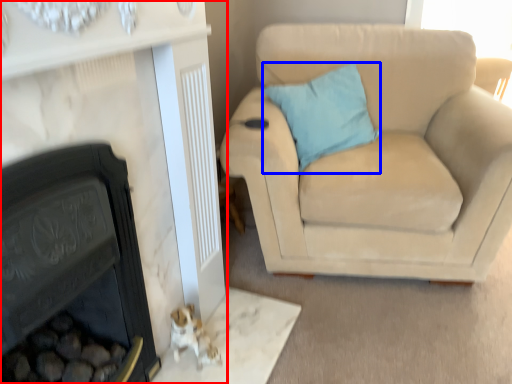
Question: Which of the following is the farthest to the observer, fireplace (highlighted by a red box) or pillow (highlighted by a blue box)?

Choices:
 (A) fireplace
 (B) pillow

Answer: (B)